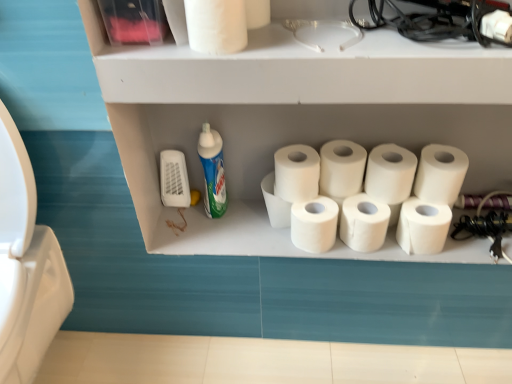
At what (x,y) coordinates should I click in order to perform the action: click on free point to the right of blue glossy bottle at center-left. Please return your answer as a coordinate pair (x, y). The height and width of the screenshot is (384, 512). Looking at the image, I should click on (252, 215).